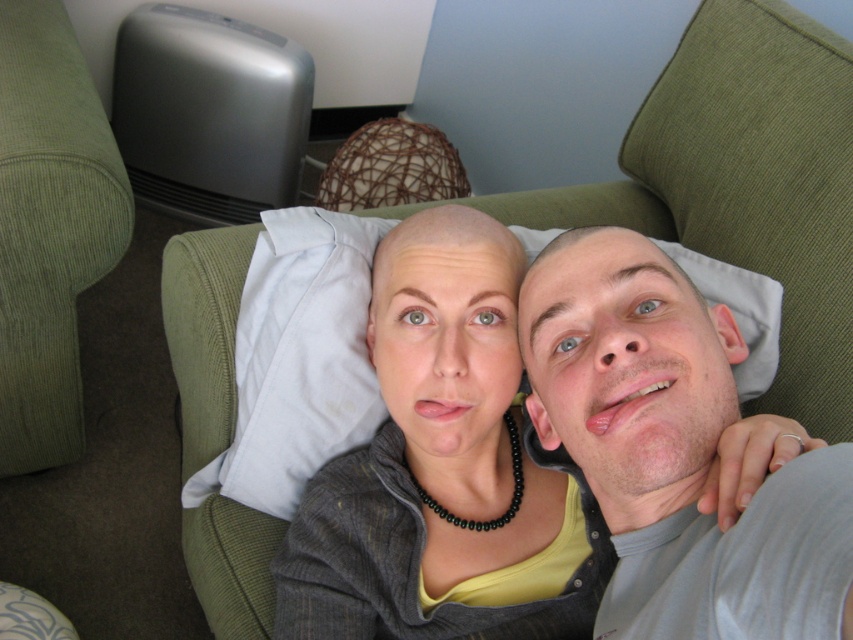
Question: Does matte gray sweater at center have a lesser width compared to gray fabric shirt at upper right?

Choices:
 (A) no
 (B) yes

Answer: (A)

Question: Considering the real-world distances, which object is closest to the white fabric pillow at center?

Choices:
 (A) gray fabric shirt at upper right
 (B) matte gray sweater at center

Answer: (B)

Question: Is matte gray sweater at center smaller than gray fabric shirt at upper right?

Choices:
 (A) no
 (B) yes

Answer: (A)

Question: Which object is the farthest from the gray fabric shirt at upper right?

Choices:
 (A) matte gray sweater at center
 (B) white fabric pillow at center

Answer: (B)

Question: Is matte gray sweater at center closer to camera compared to gray fabric shirt at upper right?

Choices:
 (A) yes
 (B) no

Answer: (B)

Question: Which point appears closest to the camera in this image?

Choices:
 (A) (712, 298)
 (B) (537, 483)

Answer: (B)